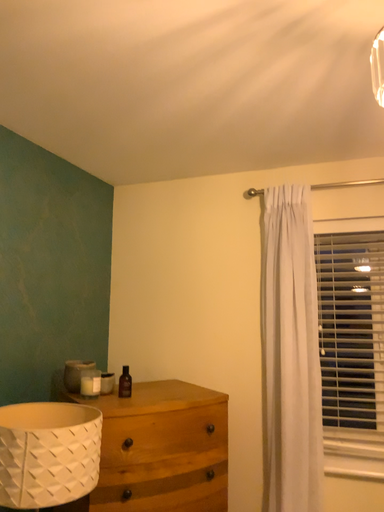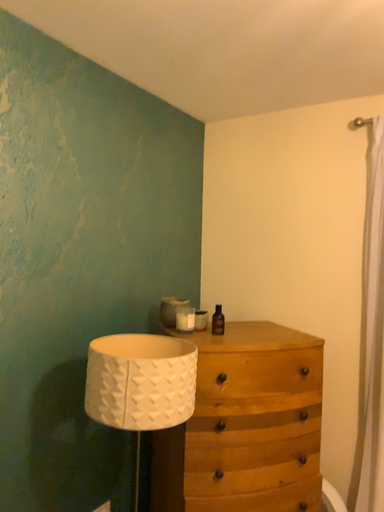
Question: Which way did the camera rotate in the video?

Choices:
 (A) rotated right
 (B) rotated left

Answer: (B)